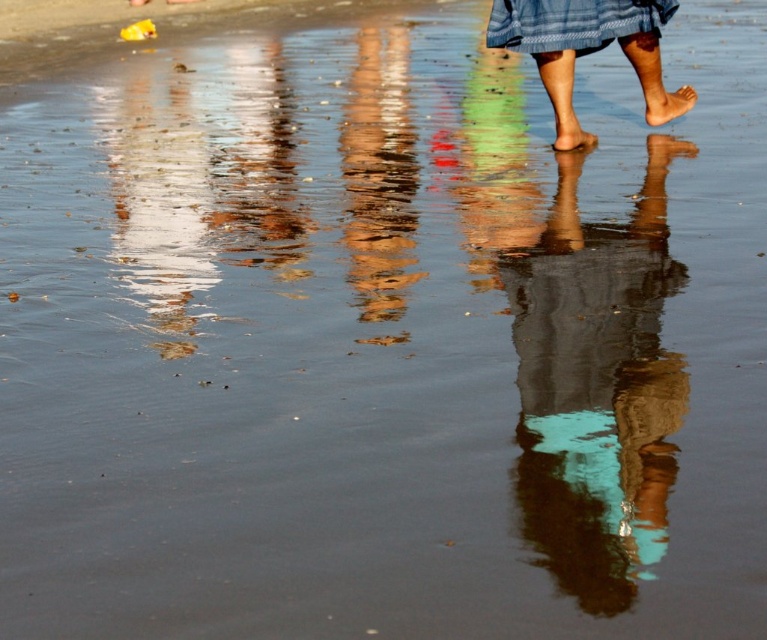
Question: Which point is closer to the camera taking this photo?

Choices:
 (A) (675, 4)
 (B) (695, 96)

Answer: (A)

Question: Where is shiny metallic pole at center located in relation to blue plaid skirt at upper center in the image?

Choices:
 (A) left
 (B) right

Answer: (A)

Question: Which object is closer to the camera taking this photo?

Choices:
 (A) blue plaid skirt at upper center
 (B) smooth skin foot at center
 (C) matte skin foot at center
 (D) shiny metallic pole at center

Answer: (D)

Question: Is teal fabric at center bigger than blue plaid skirt at upper center?

Choices:
 (A) yes
 (B) no

Answer: (A)

Question: Is blue plaid skirt at upper center positioned behind smooth skin foot at center?

Choices:
 (A) no
 (B) yes

Answer: (A)

Question: Estimate the real-world distances between objects in this image. Which object is farther from the teal fabric at center?

Choices:
 (A) smooth skin foot at center
 (B) matte skin foot at center
 (C) shiny metallic pole at center

Answer: (A)